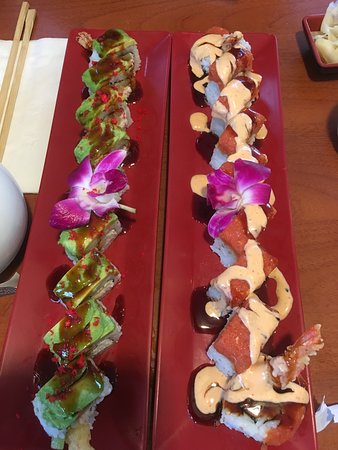
You are a GUI agent. You are given a task and a screenshot of the screen. Output one action in this format:
    pyautogui.click(x=<x>, y=<y>)
    Task: Click on the table
    The height and width of the screenshot is (450, 338).
    Given the screenshot: What is the action you would take?
    pyautogui.click(x=293, y=76)